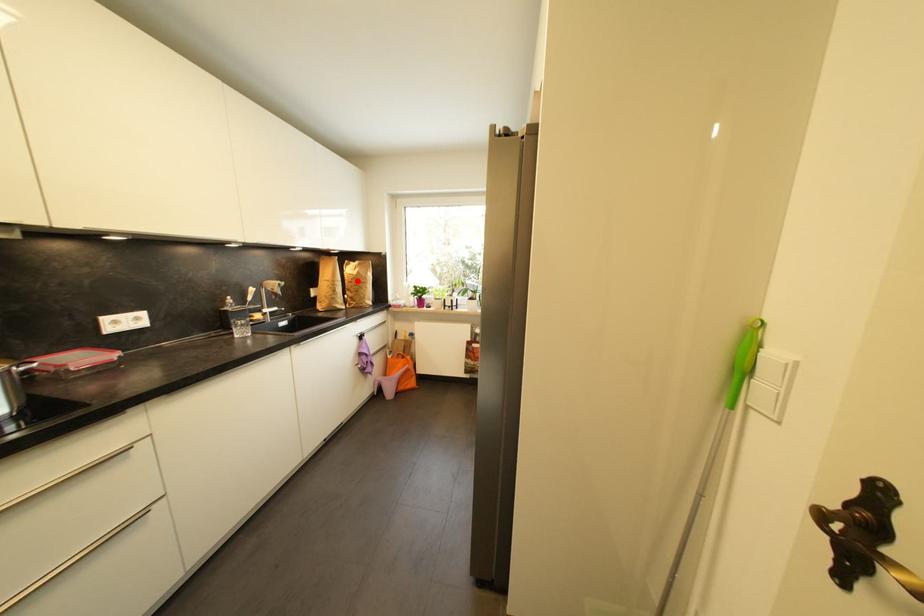
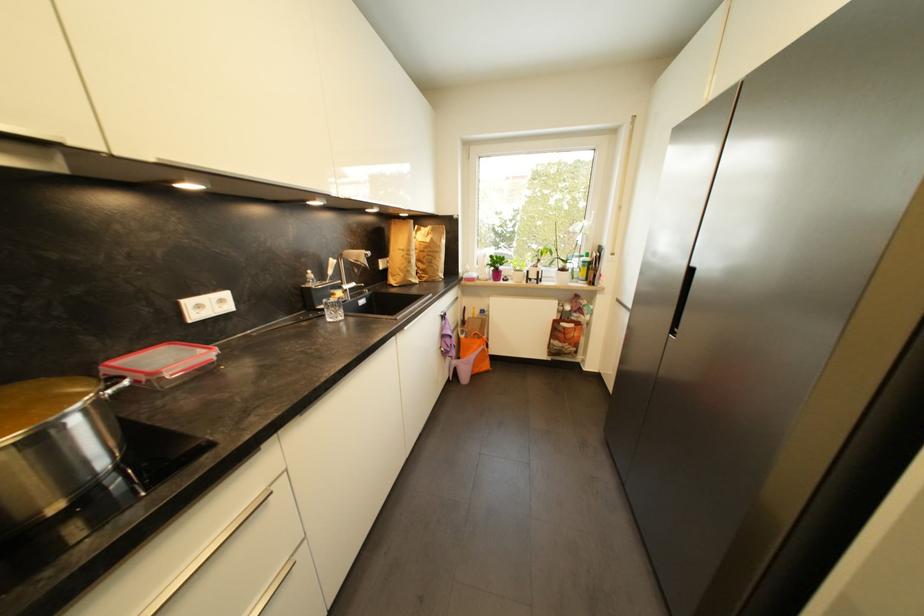
Find the pixel in the second image that matches the highlighted location in the first image.

(430, 249)